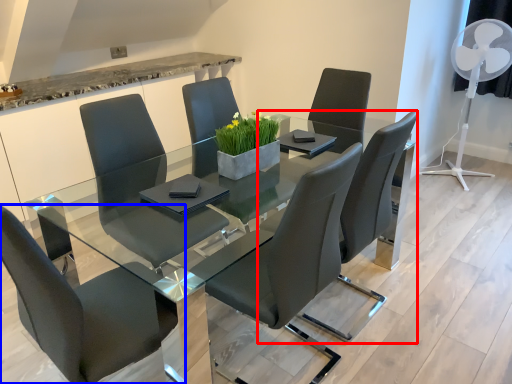
Question: Which object is further to the camera taking this photo, chair (highlighted by a red box) or chair (highlighted by a blue box)?

Choices:
 (A) chair
 (B) chair

Answer: (A)